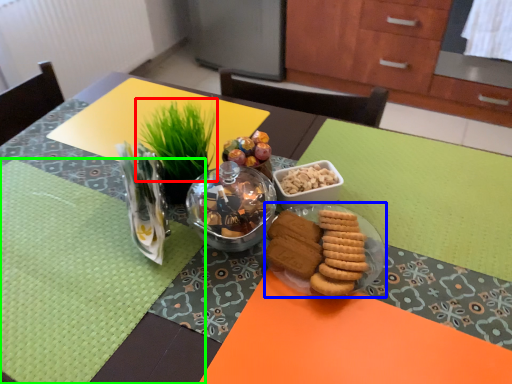
Question: Estimate the real-world distances between objects in this image. Which object is farther from grass (highlighted by a red box), glass plate (highlighted by a blue box) or place mat (highlighted by a green box)?

Choices:
 (A) glass plate
 (B) place mat

Answer: (A)